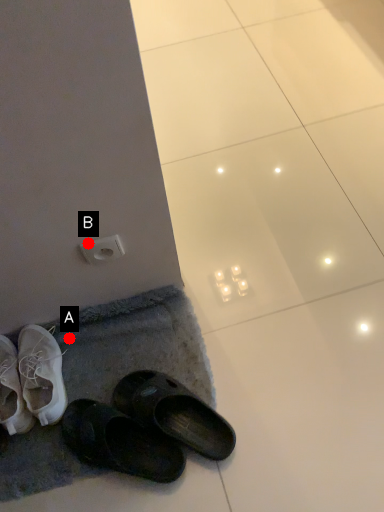
Question: Two points are circled on the image, labeled by A and B beside each circle. Which point is closer to the camera?

Choices:
 (A) A is closer
 (B) B is closer

Answer: (B)